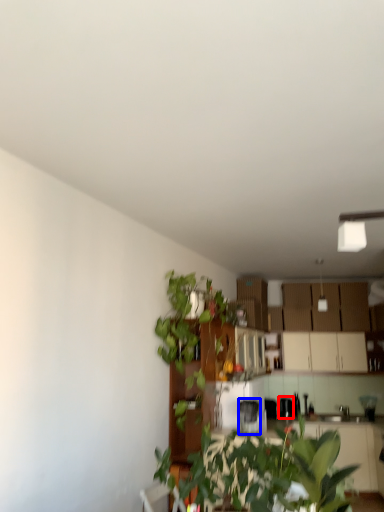
Question: Which point is closer to the camera, appliance (highlighted by a red box) or appliance (highlighted by a blue box)?

Choices:
 (A) appliance
 (B) appliance

Answer: (B)